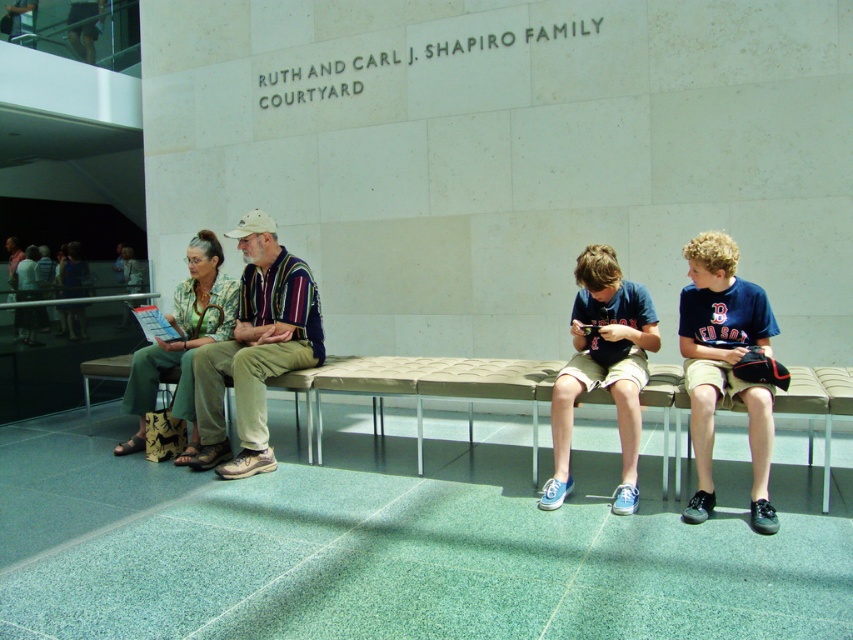
Question: Can you confirm if beige quilted fabric bench at center is positioned to the right of blue cotton shirt at right?

Choices:
 (A) no
 (B) yes

Answer: (A)

Question: Estimate the real-world distances between objects in this image. Which object is closer to the beige quilted fabric bench at center?

Choices:
 (A) blue canvas sneakers at center
 (B) blue cotton shirt at right
 (C) striped cotton shirt at center

Answer: (A)

Question: Which point appears closest to the camera in this image?

Choices:
 (A) (816, 412)
 (B) (264, 419)
 (C) (607, 324)

Answer: (A)

Question: Can you confirm if blue cotton shirt at right is smaller than blue canvas sneakers at center?

Choices:
 (A) no
 (B) yes

Answer: (A)

Question: Which point appears farthest from the camera in this image?

Choices:
 (A) (840, 404)
 (B) (599, 284)
 (C) (711, 291)
 (D) (241, 224)

Answer: (D)

Question: Considering the relative positions of blue cotton shirt at right and blue canvas sneakers at center in the image provided, where is blue cotton shirt at right located with respect to blue canvas sneakers at center?

Choices:
 (A) left
 (B) right

Answer: (B)